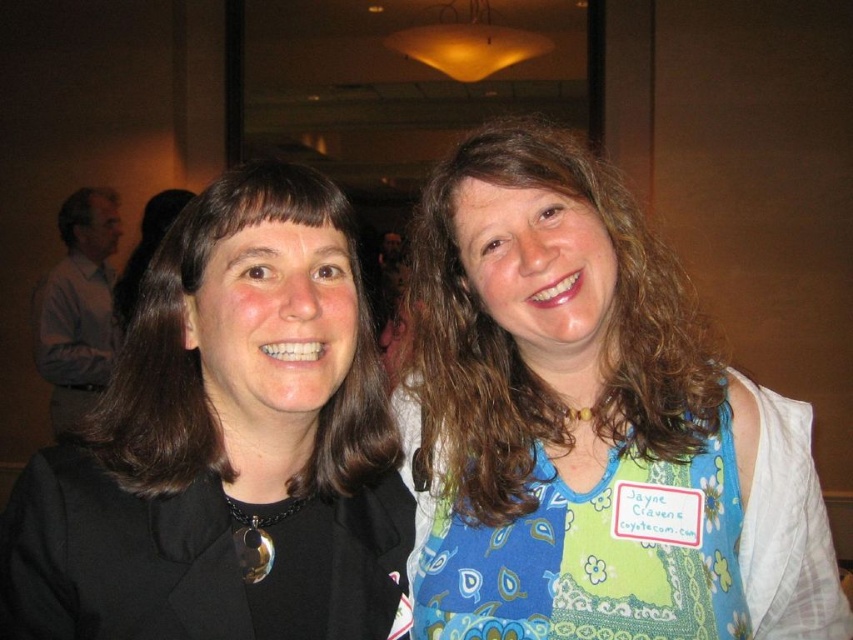
Question: Which point is farther from the camera taking this photo?

Choices:
 (A) (398, 392)
 (B) (627, 573)

Answer: (A)

Question: Which point is farther from the camera taking this photo?

Choices:
 (A) (669, 618)
 (B) (207, 323)

Answer: (A)

Question: Is blue floral dress at center smaller than black fabric at left?

Choices:
 (A) yes
 (B) no

Answer: (B)

Question: Which point is closer to the camera?

Choices:
 (A) black fabric at left
 (B) blue floral dress at center
 (C) blue patchwork apron at right

Answer: (A)

Question: Is black fabric at left to the left of blue patchwork apron at right from the viewer's perspective?

Choices:
 (A) yes
 (B) no

Answer: (A)

Question: Can you confirm if blue floral dress at center is positioned to the left of blue patchwork apron at right?

Choices:
 (A) no
 (B) yes

Answer: (B)